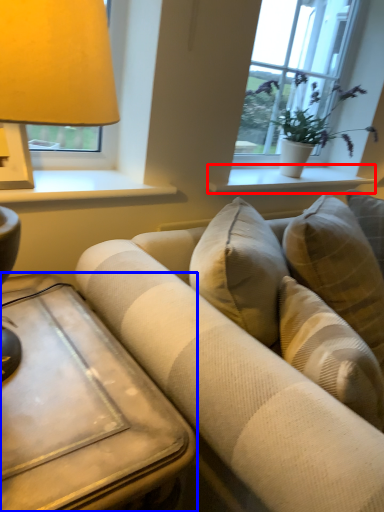
Question: Among these objects, which one is farthest to the camera, window sill (highlighted by a red box) or table (highlighted by a blue box)?

Choices:
 (A) window sill
 (B) table

Answer: (A)